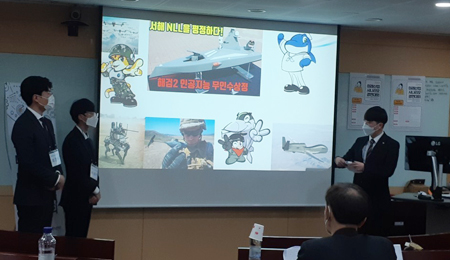
The height and width of the screenshot is (260, 450). Find the location of `ceiling light`. ceiling light is located at coordinates (378, 18), (256, 11).